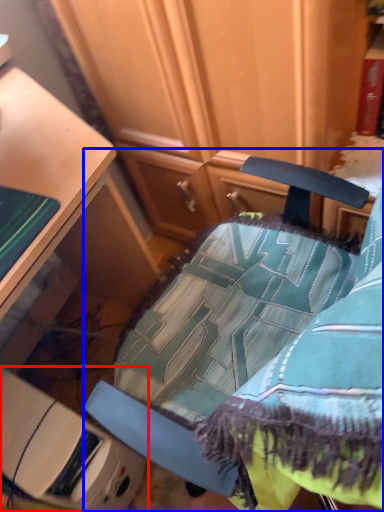
Question: Which object is closer to the camera taking this photo, furniture (highlighted by a red box) or chair (highlighted by a blue box)?

Choices:
 (A) furniture
 (B) chair

Answer: (B)